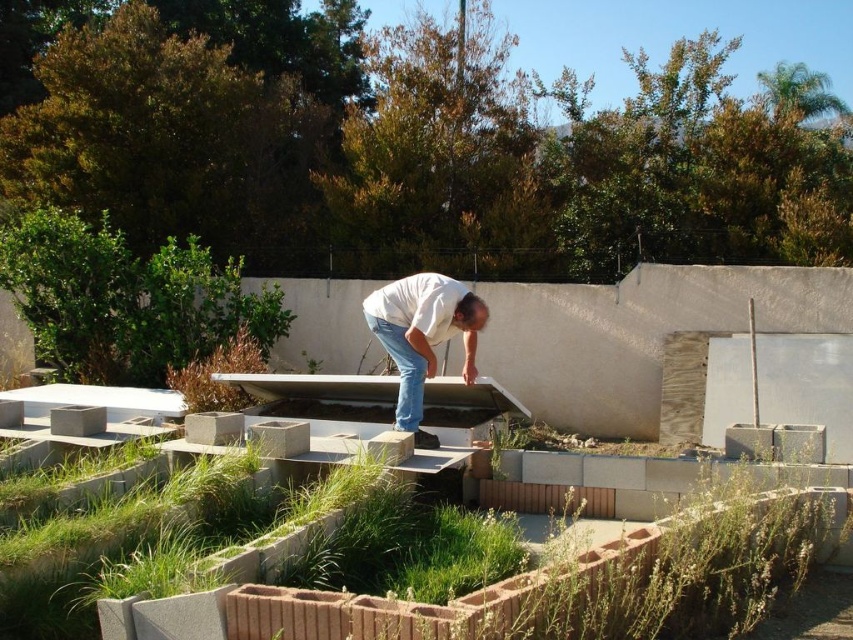
Can you confirm if white matte shirt at center is positioned below jeans at center?

No.

Is white matte shirt at center positioned before jeans at center?

Yes, white matte shirt at center is in front of jeans at center.

Where is `white matte shirt at center`? The height and width of the screenshot is (640, 853). white matte shirt at center is located at coordinates (422, 333).